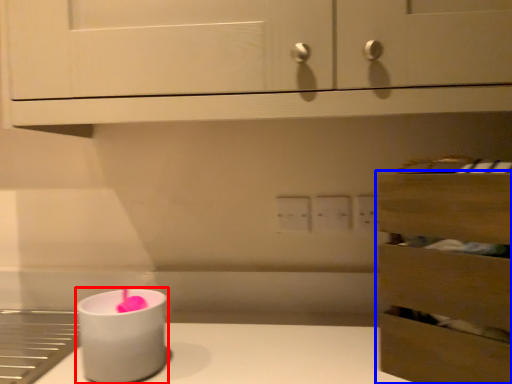
Question: Among these objects, which one is farthest to the camera, candle holder (highlighted by a red box) or drawer (highlighted by a blue box)?

Choices:
 (A) candle holder
 (B) drawer

Answer: (A)